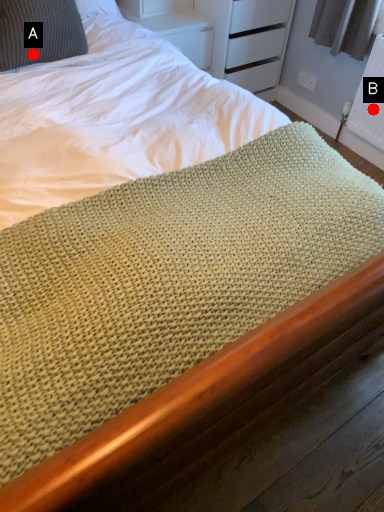
Question: Two points are circled on the image, labeled by A and B beside each circle. Which point is further to the camera?

Choices:
 (A) A is further
 (B) B is further

Answer: (B)